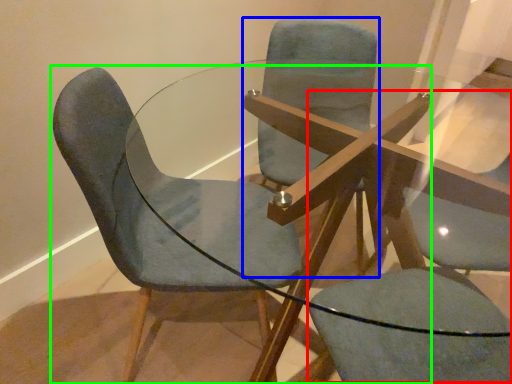
Question: Which is farther away from swivel chair (highlighted by a red box)? chair (highlighted by a blue box) or chair (highlighted by a green box)?

Choices:
 (A) chair
 (B) chair

Answer: (A)